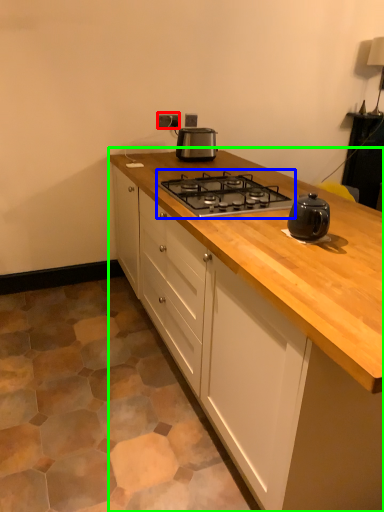
Question: Considering the real-world distances, which object is farthest from electric outlet (highlighted by a red box)? gas stove (highlighted by a blue box) or cabinetry (highlighted by a green box)?

Choices:
 (A) gas stove
 (B) cabinetry

Answer: (B)